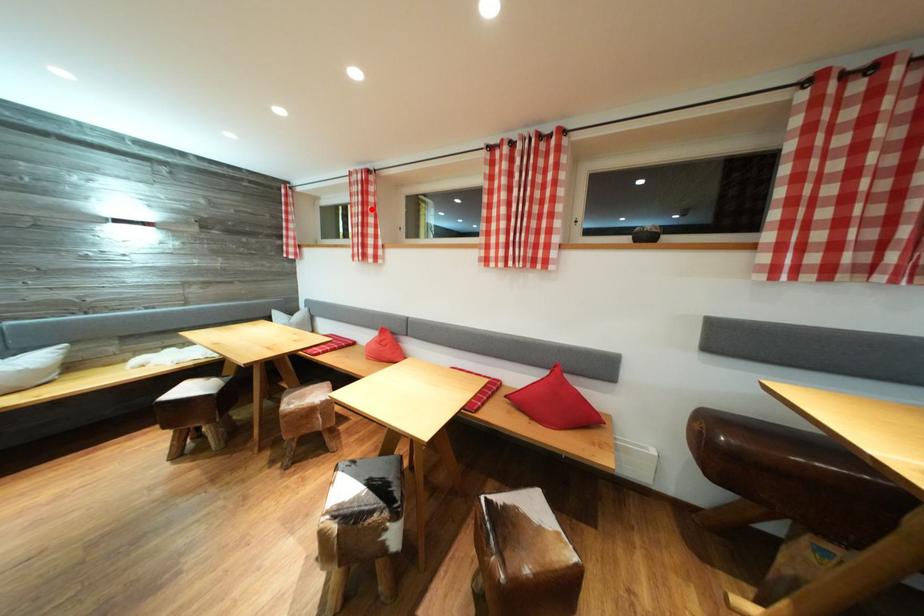
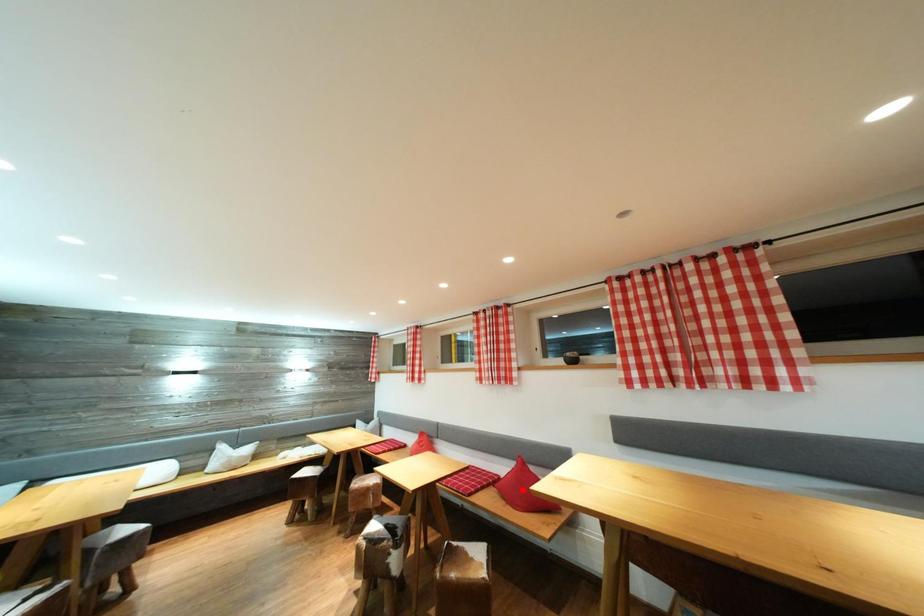
I am providing you with two images of the same scene from different viewpoints. A red point is marked on the first image and another point is marked on the second image. Is the red point in image1 aligned with the point shown in image2?

No